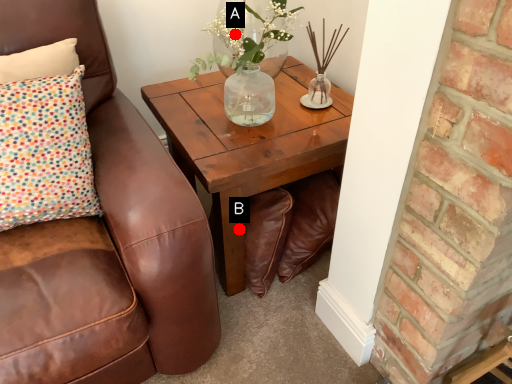
Question: Two points are circled on the image, labeled by A and B beside each circle. Which point is closer to the camera?

Choices:
 (A) A is closer
 (B) B is closer

Answer: (A)